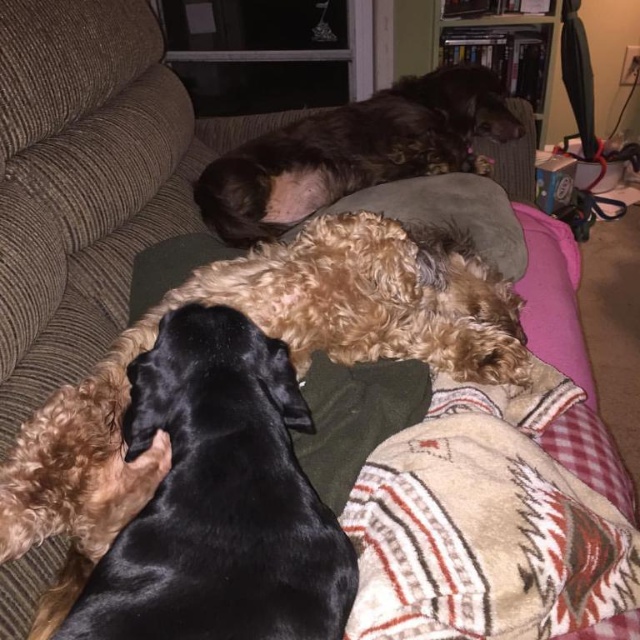
Question: Observing the image, what is the correct spatial positioning of black silky dog at center in reference to plaid fleece blanket at lower right?

Choices:
 (A) above
 (B) below

Answer: (A)

Question: In this image, where is black silky dog at center located relative to plaid fleece blanket at lower right?

Choices:
 (A) left
 (B) right

Answer: (A)

Question: Which object appears farthest from the camera in this image?

Choices:
 (A) black silky dog at center
 (B) plaid fleece blanket at lower right
 (C) shiny brown fur at upper center

Answer: (C)

Question: Which point is farther to the camera?

Choices:
 (A) black silky dog at center
 (B) shiny brown fur at upper center

Answer: (B)

Question: Is the position of black silky dog at center less distant than that of shiny brown fur at upper center?

Choices:
 (A) yes
 (B) no

Answer: (A)

Question: Which of the following is the farthest from the observer?

Choices:
 (A) (429, 605)
 (B) (173, 332)

Answer: (B)